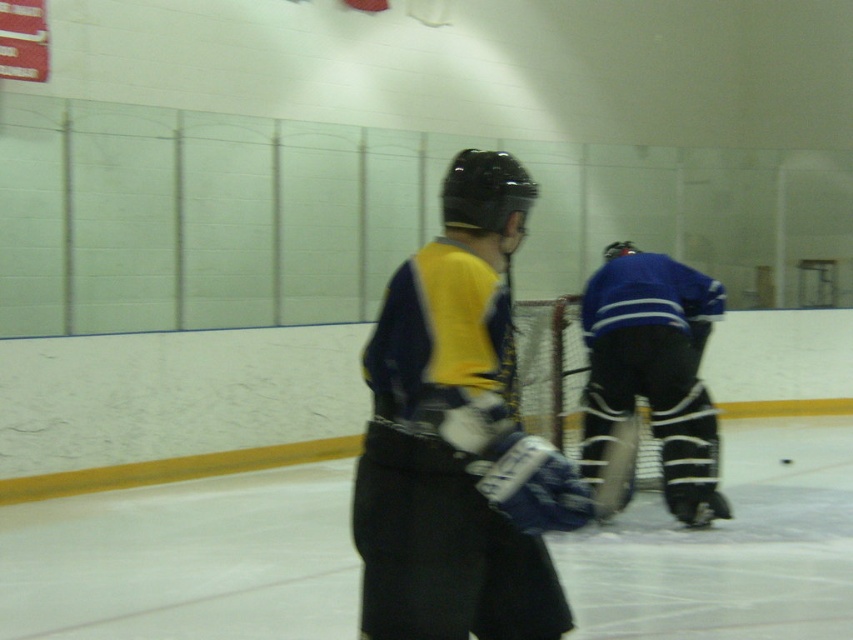
Question: Does matte black hockey stick at center have a smaller size compared to white padded goalie at center?

Choices:
 (A) yes
 (B) no

Answer: (A)

Question: Can you confirm if matte black hockey stick at center is smaller than white padded goalie at center?

Choices:
 (A) yes
 (B) no

Answer: (A)

Question: Which of the following is the farthest from the observer?

Choices:
 (A) matte black hockey stick at center
 (B) white padded goalie at center

Answer: (B)

Question: Is matte black hockey stick at center smaller than white padded goalie at center?

Choices:
 (A) yes
 (B) no

Answer: (A)